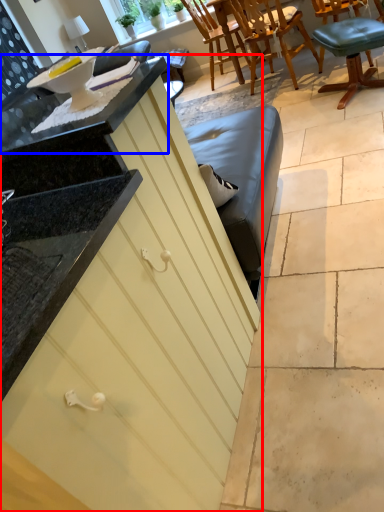
Question: Among these objects, which one is farthest to the camera, cabinetry (highlighted by a red box) or countertop (highlighted by a blue box)?

Choices:
 (A) cabinetry
 (B) countertop

Answer: (B)